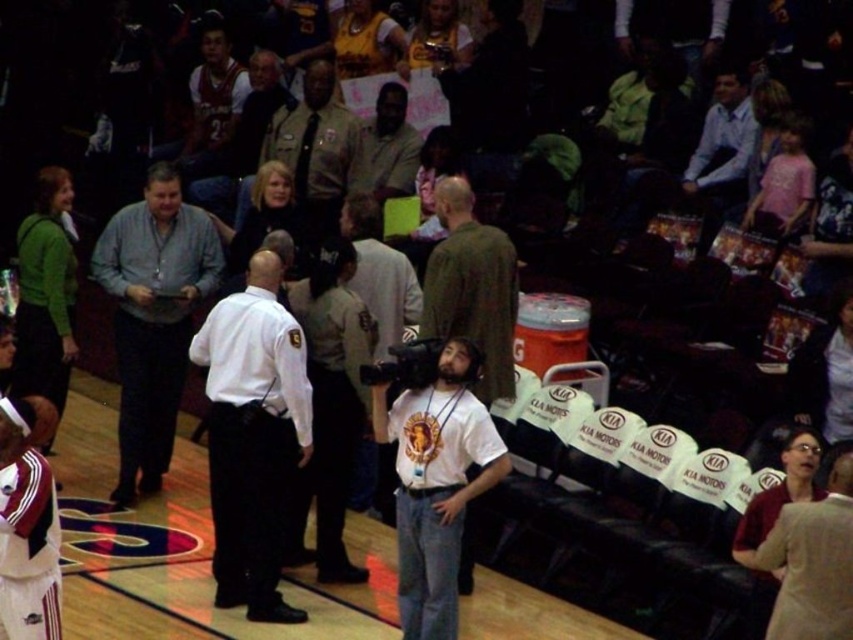
You are standing at the point marked as point (181, 308) in the image. You want to move to the nearest exit, which is located 50 feet away from your current position. Is the exit within your reach without needing to walk further than 50 feet?

The distance between you and the viewer is 32.85 feet, which is less than 50 feet, so the exit is within reach.

You are a photographer at the basketball event. You need to capture a photo of the dark blue shirt at center without the beige fabric dress at lower right appearing in the frame. Is this possible given their positions?

The beige fabric dress at lower right is positioned under the dark blue shirt at center, so if you position yourself to focus on the dark blue shirt at center from above or adjust the camera angle to avoid the lower area where the beige fabric dress at lower right is located, it should be possible to exclude the dress from the frame.